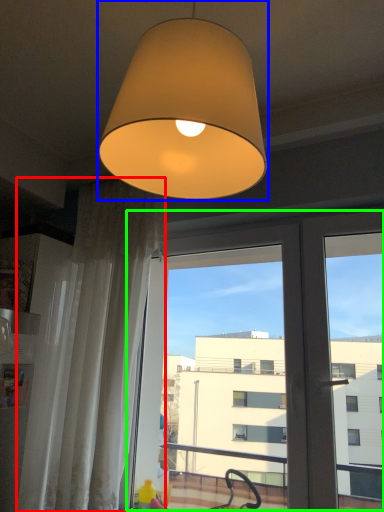
Question: Estimate the real-world distances between objects in this image. Which object is closer to curtain (highlighted by a red box), lamp (highlighted by a blue box) or screen door (highlighted by a green box)?

Choices:
 (A) lamp
 (B) screen door

Answer: (B)